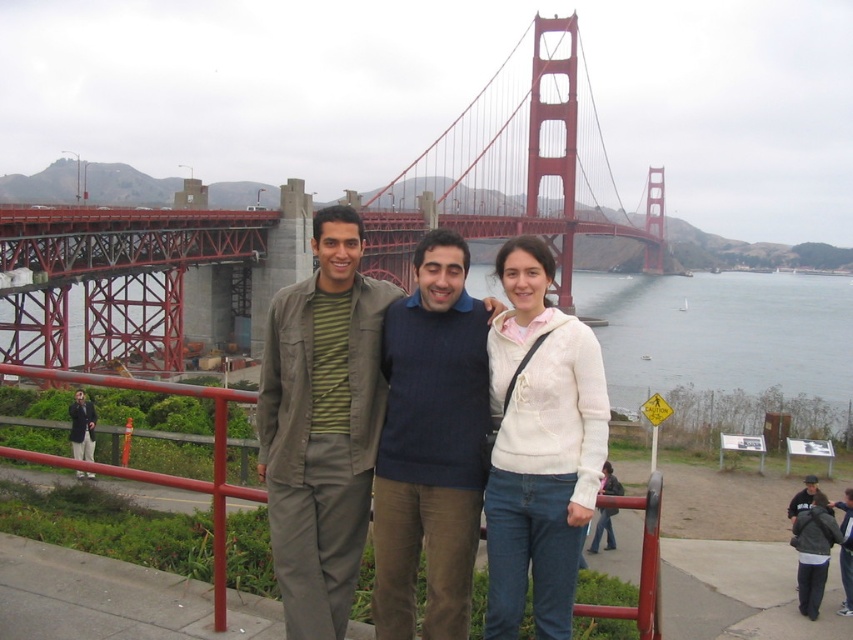
You are a photographer standing at the Golden Gate Bridge. You notice two people in the foreground wearing a matte green shirt at center and a white knit sweater at center. Which clothing item is positioned closer to you?

The matte green shirt at center is closer to the viewer than the white knit sweater at center.

From the picture: You are a photographer standing at the camera position, and you want to ensure the white knit sweater at center is in focus. If your camera has a depth of field range of 150 feet, will the sweater be in focus?

The white knit sweater at center and camera are 149.77 feet apart from each other. Since the distance is within the 150 feet depth of field range, the sweater will be in focus.

You are standing in front of the Golden Gate Bridge and want to take a photo of two specific points marked in the scene. The first point is at coordinates point (456, 308) and the second point is at point (225, 442). Which of these two points is closer to you, the photographer?

Point (456, 308) is closer to you because it is further to the viewer than point (225, 442).